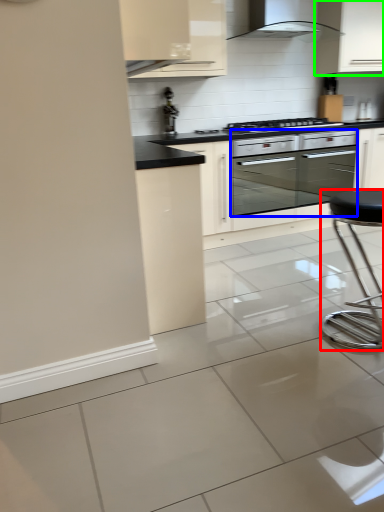
Question: Estimate the real-world distances between objects in this image. Which object is closer to bar stool (highlighted by a red box), oven (highlighted by a blue box) or cabinetry (highlighted by a green box)?

Choices:
 (A) oven
 (B) cabinetry

Answer: (A)